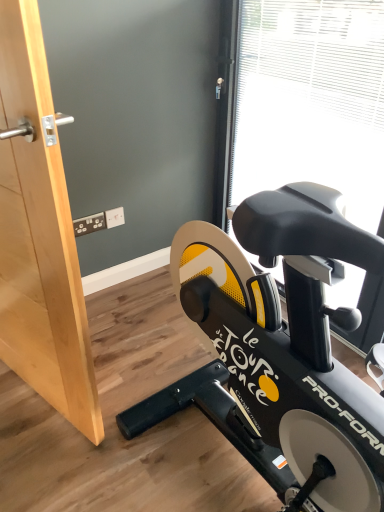
At what (x,y) coordinates should I click in order to perform the action: click on free space in front of wooden door at left. Please return your answer as a coordinate pair (x, y). The image size is (384, 512). Looking at the image, I should click on tap(36, 455).